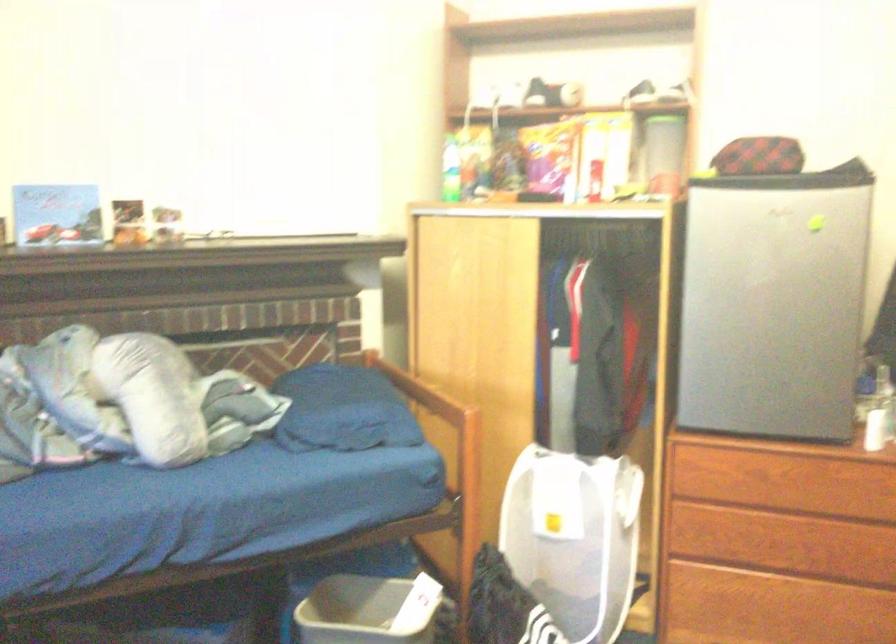
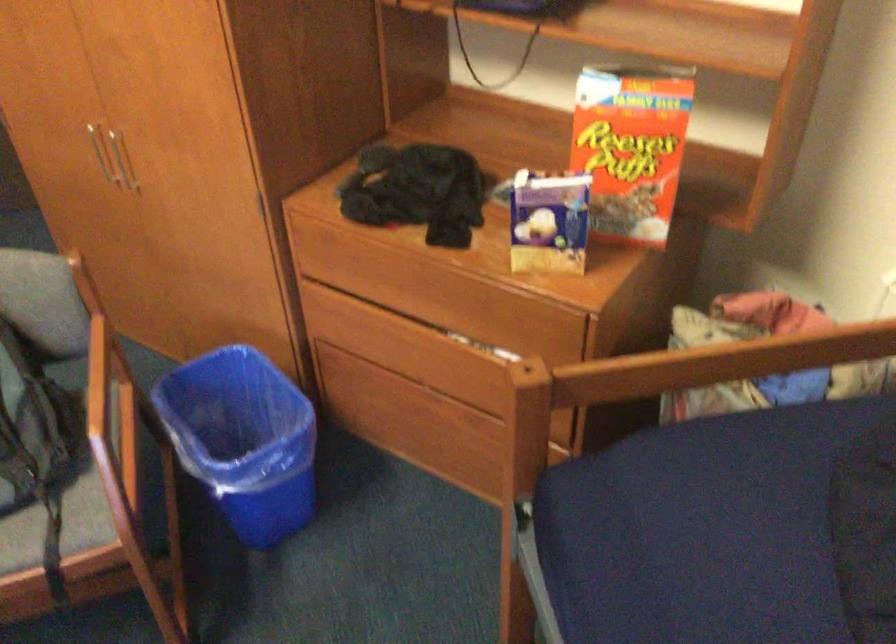
Based on the continuous images, in which direction is the camera rotating?

The camera rotated toward right-down.